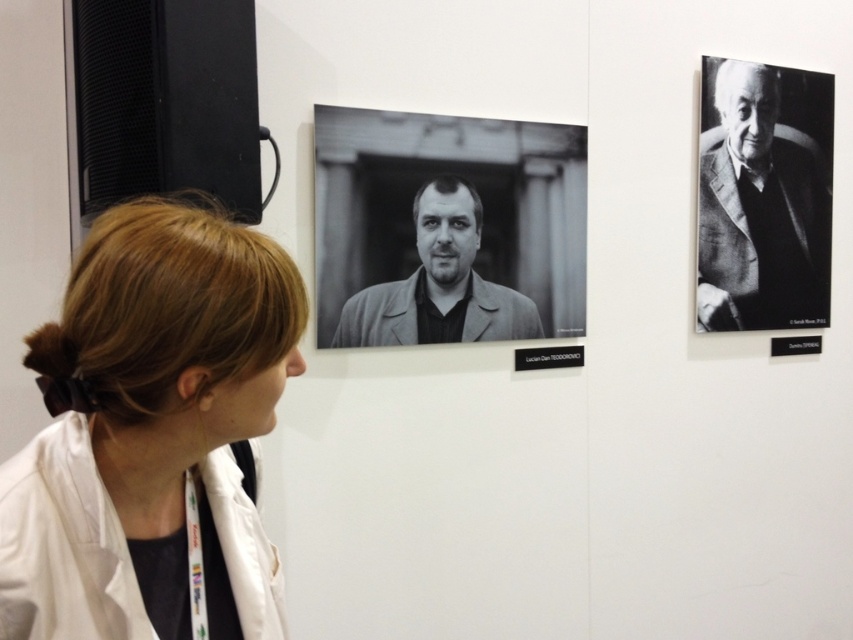
The woman is trying to take a photo of both the black textured suit at upper right and the black matte jacket at center. However, she notices that one of the portraits is partially blocking the other. Which portrait is blocking the other one?

A: The black matte jacket at center is behind the black textured suit at upper right, so the black textured suit at upper right is blocking the black matte jacket at center.

You are an event photographer at the exhibition. You need to capture a photo of both the black textured suit at upper right and the black matte jacket at center. Which object should you frame first in your camera to ensure both fit in the shot?

The black textured suit at upper right has a smaller width than the black matte jacket at center, so you should frame the black textured suit at upper right first to ensure both objects fit in the shot.

You are an art curator planning to install a new sculpture between the blonde hair at center and the black textured suit at upper right. The sculpture requires a minimum of 8 feet of space between the two portraits to be safely placed. Based on the current distance, is this feasible?

The distance between the blonde hair at center and the black textured suit at upper right is 7.77 feet, which is less than the required 8 feet. Therefore, the sculpture cannot be safely placed between them with the current spacing.